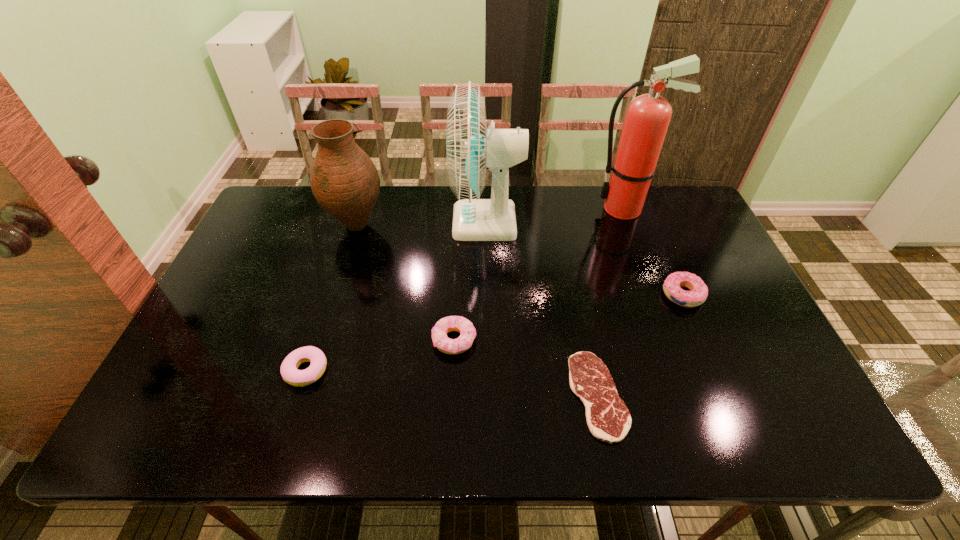
The height and width of the screenshot is (540, 960). In the image, there is a desktop. Identify the location of vacant area at the right edge. (749, 309).

The height and width of the screenshot is (540, 960). What are the coordinates of `vacant space at the far right corner of the desktop` in the screenshot? It's located at (653, 201).

What are the coordinates of `vacant space in between the third tallest object and the leftmost doughnut` in the screenshot? It's located at [331, 298].

You are a GUI agent. You are given a task and a screenshot of the screen. Output one action in this format:
    pyautogui.click(x=<x>, y=<y>)
    Task: Click on the free spot between the second doughnut from left to right and the fan
    The image size is (960, 540).
    Given the screenshot: What is the action you would take?
    click(470, 281)

This screenshot has width=960, height=540. Identify the location of empty location between the steak and the second doughnut from right to left. (526, 368).

What are the coordinates of `empty space between the fire extinguisher and the second doughnut from right to left` in the screenshot? It's located at (539, 274).

Locate an element on the screen. This screenshot has height=540, width=960. empty space between the leftmost doughnut and the fifth shortest object is located at coordinates (331, 298).

This screenshot has width=960, height=540. Identify the location of free point between the vase and the fan. (421, 224).

Locate an element on the screen. The height and width of the screenshot is (540, 960). blank region between the shortest object and the leftmost doughnut is located at coordinates (452, 383).

Identify the location of vacant area between the second doughnut from left to right and the shortest object. (526, 368).